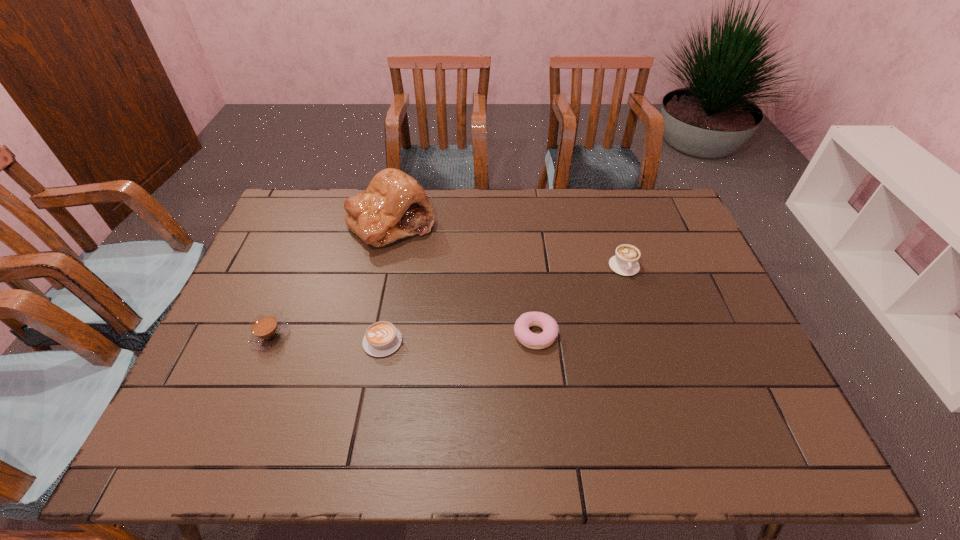
Find the location of a particular element. This screenshot has height=540, width=960. bread is located at coordinates (394, 205).

Where is `the tallest object`? The height and width of the screenshot is (540, 960). the tallest object is located at coordinates (394, 205).

You are a GUI agent. You are given a task and a screenshot of the screen. Output one action in this format:
    pyautogui.click(x=<x>, y=<y>)
    Task: Click on the rightmost object
    
    Given the screenshot: What is the action you would take?
    pyautogui.click(x=624, y=262)

Where is `the rightmost cappuccino`? the rightmost cappuccino is located at coordinates (624, 262).

Where is `the leftmost object`? The image size is (960, 540). the leftmost object is located at coordinates (266, 331).

Locate an element on the screen. The image size is (960, 540). the second shortest object is located at coordinates (549, 326).

Where is `doughnut`? The height and width of the screenshot is (540, 960). doughnut is located at coordinates (549, 326).

What are the coordinates of `the shortest cappuccino` in the screenshot? It's located at (382, 338).

Where is `the second cappuccino from right to left`? The width and height of the screenshot is (960, 540). the second cappuccino from right to left is located at coordinates (382, 338).

Image resolution: width=960 pixels, height=540 pixels. What are the coordinates of `free space located on the filling side of the tallest object` in the screenshot? It's located at (372, 309).